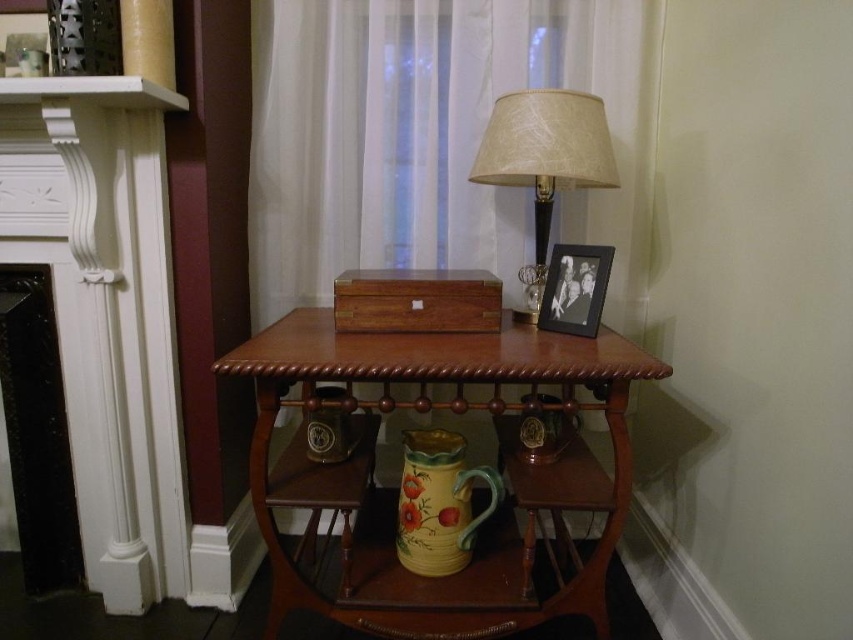
You are arranging a shelf and need to place the beige fabric lampshade at upper right and the matte ceramic vase at center. If the shelf has limited width, which object should you place first to ensure both fit?

The beige fabric lampshade at upper right might be wider than the matte ceramic vase at center, so placing the vase first would leave space for the lampshade, but since the lampshade might be wider, it should be placed first to accommodate its width.

You are standing in the room and want to place a small plant between the two points, point [433,257] and point [142,600]. Which point should you place the plant closer to so it appears closer to you?

You should place the plant closer to point [433,257] because it is closer to you than point [142,600].

You are standing in the room and see the point marked at coordinate (326, 488). Which object is this point located on?

The point at coordinate (326, 488) is located on the matte ceramic vase at center.